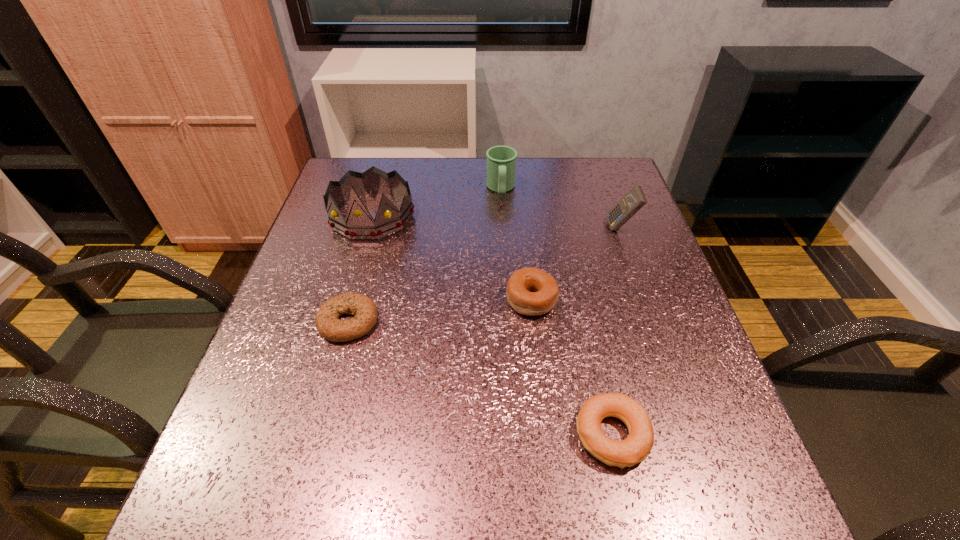
Find the location of a particular element. This screenshot has width=960, height=540. vacant space that's between the tiara and the third shortest object is located at coordinates (452, 258).

Where is `vacant point located between the tallest bagel and the nearest object`? The image size is (960, 540). vacant point located between the tallest bagel and the nearest object is located at coordinates (572, 367).

Where is `free point between the leftmost bagel and the nearest object`? free point between the leftmost bagel and the nearest object is located at coordinates (480, 379).

This screenshot has width=960, height=540. I want to click on unoccupied area between the third shortest object and the calculator, so click(x=576, y=264).

Locate an element on the screen. vacant region between the tallest object and the rightmost object is located at coordinates (496, 221).

Locate an element on the screen. object that stands as the third closest to the nearest object is located at coordinates (634, 200).

Where is `object that is the third closest to the calculator`? object that is the third closest to the calculator is located at coordinates (634, 449).

Find the location of a particular element. Image resolution: width=960 pixels, height=540 pixels. bagel that is the closest to the mug is located at coordinates (530, 291).

You are a GUI agent. You are given a task and a screenshot of the screen. Output one action in this format:
    pyautogui.click(x=<x>, y=<y>)
    Task: Click on the bagel that is the closest one to the leftmost bagel
    The image size is (960, 540).
    Given the screenshot: What is the action you would take?
    pyautogui.click(x=530, y=291)

Identify the location of blank area in the image that satisfies the following two spatial constraints: 1. on the front-facing side of the rightmost object; 2. on the front side of the tallest bagel. The width and height of the screenshot is (960, 540). (647, 299).